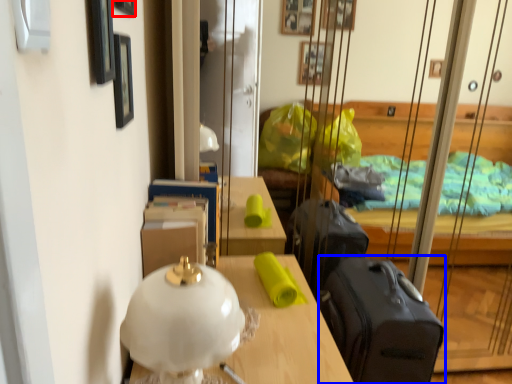
Question: Which of the following is the farthest to the observer, picture frame (highlighted by a red box) or suitcase (highlighted by a blue box)?

Choices:
 (A) picture frame
 (B) suitcase

Answer: (B)